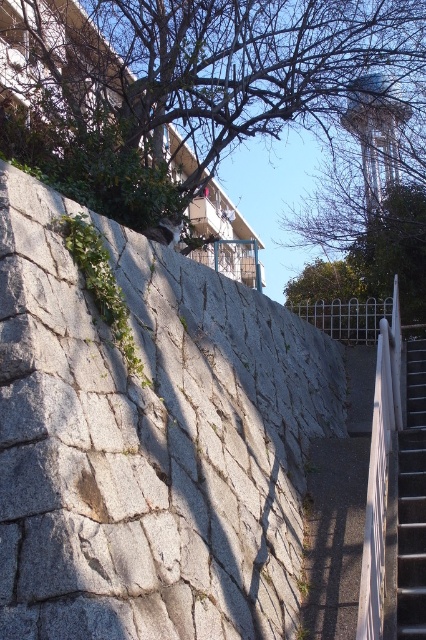
The width and height of the screenshot is (426, 640). In order to click on green leafy tree at upper center in this screenshot , I will do `click(212, 61)`.

Who is lower down, gray granite wall at center or green leafy tree at upper center?

gray granite wall at center is below.

Is point (20, 525) behind point (244, 76)?

No.

Is point (123, 547) behind point (172, 92)?

That is False.

This screenshot has height=640, width=426. I want to click on gray granite wall at center, so click(149, 442).

Between gray granite wall at center and metallic gray stair at lower right, which one is positioned lower?

metallic gray stair at lower right is below.

Is gray granite wall at center positioned in front of metallic gray stair at lower right?

Yes, it is.

Which is in front, point (109, 528) or point (397, 486)?

Positioned in front is point (109, 528).

Identify the location of gray granite wall at center. The image size is (426, 640). (149, 442).